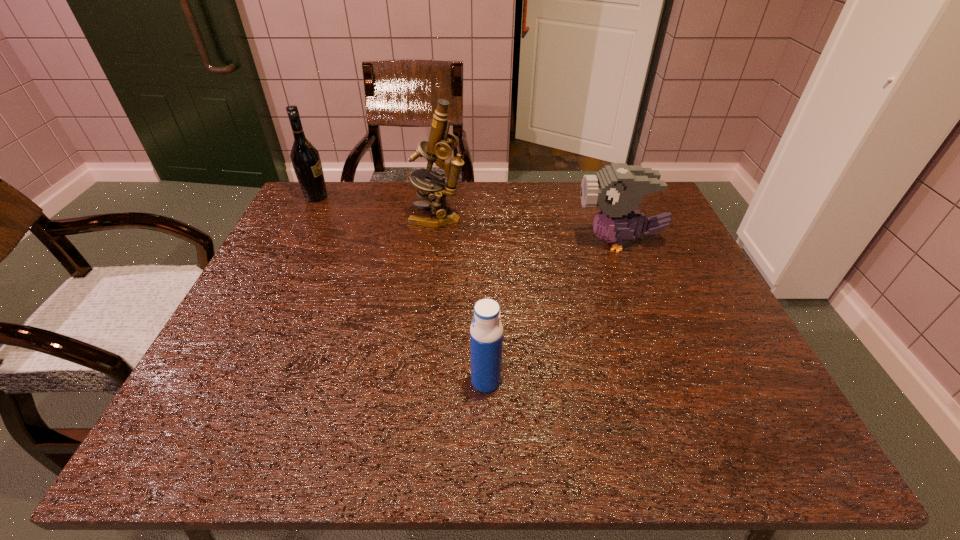
In order to click on unoccupied position between the bird and the water bottle in this screenshot , I will do `click(552, 312)`.

You are a GUI agent. You are given a task and a screenshot of the screen. Output one action in this format:
    pyautogui.click(x=<x>, y=<y>)
    Task: Click on the vacant area that lies between the third object from left to right and the microscope
    The width and height of the screenshot is (960, 540).
    Given the screenshot: What is the action you would take?
    pyautogui.click(x=462, y=300)

Find the location of a particular element. The width and height of the screenshot is (960, 540). free space between the farthest object and the microscope is located at coordinates (377, 208).

Where is `vacant area that lies between the rightmost object and the farthest object`? The image size is (960, 540). vacant area that lies between the rightmost object and the farthest object is located at coordinates pyautogui.click(x=468, y=220).

Image resolution: width=960 pixels, height=540 pixels. What are the coordinates of `empty location between the wine bottle and the nearest object` in the screenshot? It's located at [401, 289].

Image resolution: width=960 pixels, height=540 pixels. In order to click on free space that is in between the bird and the farthest object in this screenshot , I will do `click(468, 220)`.

Locate an element on the screen. The width and height of the screenshot is (960, 540). object identified as the second closest to the tallest object is located at coordinates (617, 189).

Select which object appears as the second closest to the water bottle. Please provide its 2D coordinates. Your answer should be formatted as a tuple, i.e. [(x, y)], where the tuple contains the x and y coordinates of a point satisfying the conditions above.

[(441, 143)]

This screenshot has width=960, height=540. In order to click on free point that satisfies the following two spatial constraints: 1. on the label of the farthest object; 2. on the right side of the water bottle in this screenshot , I will do `click(222, 381)`.

Locate an element on the screen. This screenshot has width=960, height=540. vacant space that satisfies the following two spatial constraints: 1. on the label of the water bottle; 2. on the left side of the leftmost object is located at coordinates (222, 381).